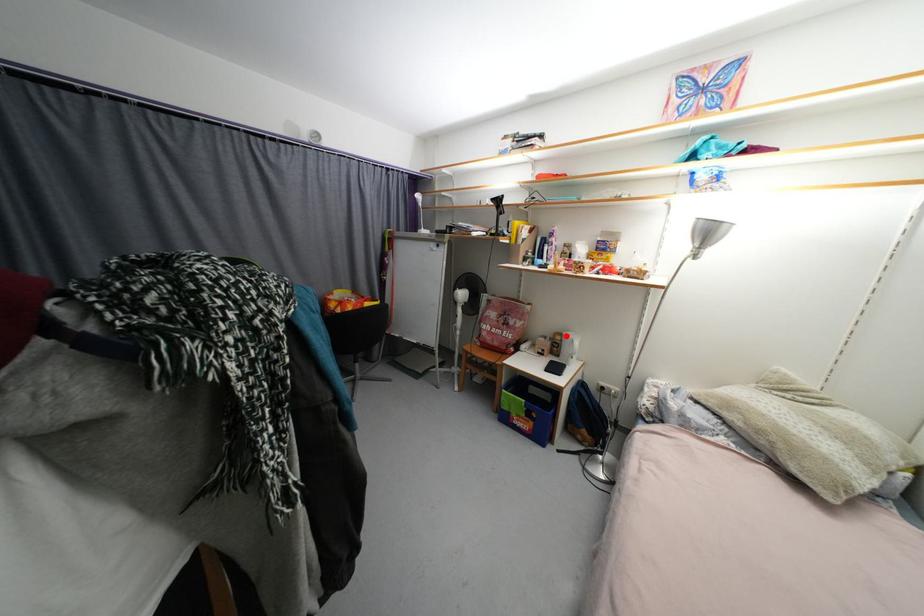
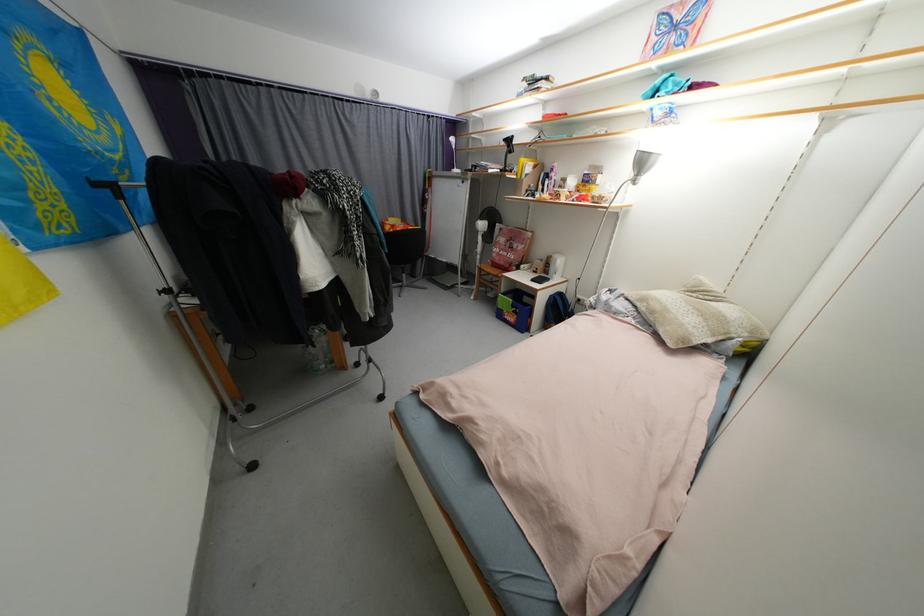
Find the pixel in the second image that matches the highlighted location in the first image.

(557, 257)